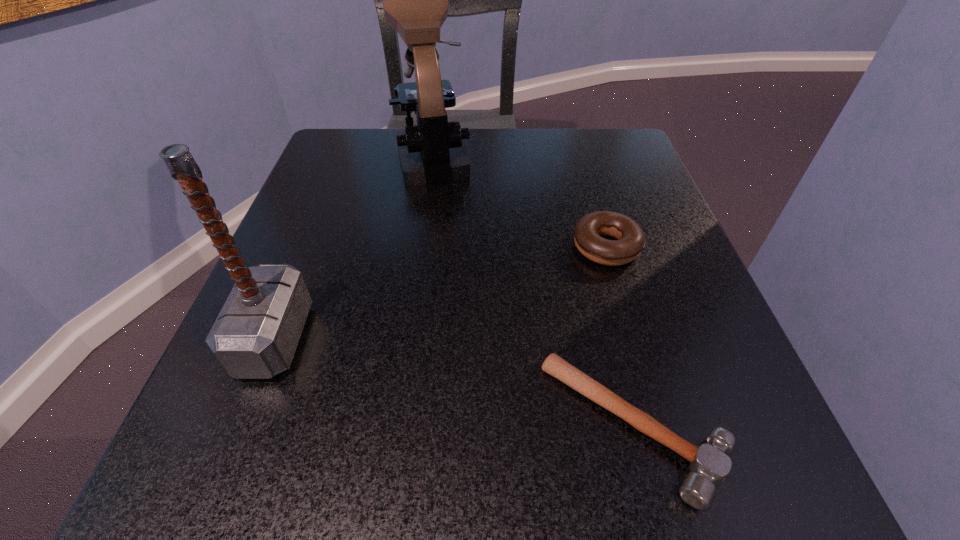
At what (x,y) coordinates should I click in order to perform the action: click on free space located on the front of the second shortest object. Please return your answer as a coordinate pair (x, y). The image size is (960, 540). Looking at the image, I should click on click(685, 515).

The image size is (960, 540). What are the coordinates of `vacant space located 0.180m on the left of the shortest object` in the screenshot? It's located at (397, 427).

Find the location of a particular element. object positioned at the far edge is located at coordinates (415, 0).

You are a GUI agent. You are given a task and a screenshot of the screen. Output one action in this format:
    pyautogui.click(x=<x>, y=<y>)
    Task: Click on the object that is at the near edge
    This screenshot has height=540, width=960.
    Given the screenshot: What is the action you would take?
    pyautogui.click(x=709, y=465)

The image size is (960, 540). What are the coordinates of `microscope positioned at the left edge` in the screenshot? It's located at pos(415,0).

Find the location of a particular element. The width and height of the screenshot is (960, 540). hammer located in the left edge section of the desktop is located at coordinates (255, 335).

The width and height of the screenshot is (960, 540). What are the coordinates of `doughnut that is positioned at the right edge` in the screenshot? It's located at (630, 242).

Locate an element on the screen. Image resolution: width=960 pixels, height=540 pixels. hammer that is at the right edge is located at coordinates (709, 465).

Image resolution: width=960 pixels, height=540 pixels. What are the coordinates of `object that is at the far left corner` in the screenshot? It's located at (415, 0).

This screenshot has height=540, width=960. I want to click on object that is at the near right corner, so click(x=709, y=465).